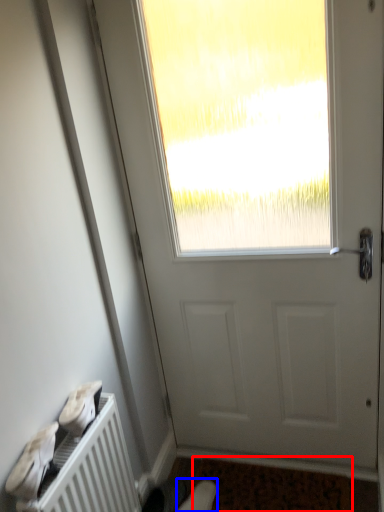
Question: Which of the following is the closest to the observer, doormat (highlighted by a red box) or shoe (highlighted by a blue box)?

Choices:
 (A) doormat
 (B) shoe

Answer: (A)